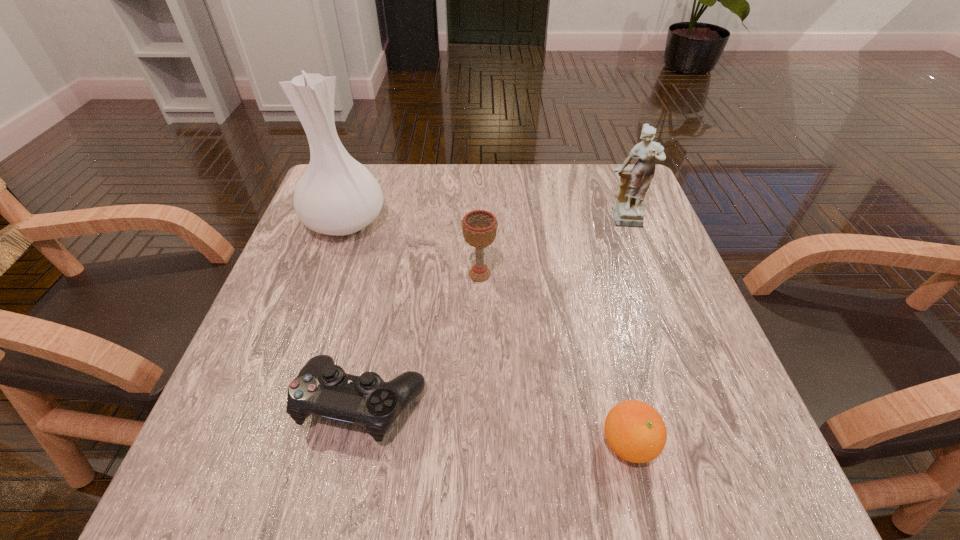
You are a GUI agent. You are given a task and a screenshot of the screen. Output one action in this format:
    pyautogui.click(x=<x>, y=<y>)
    Task: Click on the empty location between the vase and the orange
    This screenshot has width=960, height=540.
    Given the screenshot: What is the action you would take?
    pyautogui.click(x=487, y=333)

You are a GUI agent. You are given a task and a screenshot of the screen. Output one action in this format:
    pyautogui.click(x=<x>, y=<y>)
    Task: Click on the vacant space that is in between the third tallest object and the tallest object
    
    Given the screenshot: What is the action you would take?
    pyautogui.click(x=413, y=248)

Locate an element on the screen. The width and height of the screenshot is (960, 540). vacant space that is in between the rightmost object and the fourth object from left to right is located at coordinates (626, 333).

Find the location of a particular element. The width and height of the screenshot is (960, 540). vacant area between the tallest object and the third shortest object is located at coordinates click(413, 248).

Locate an element on the screen. The width and height of the screenshot is (960, 540). vacant area that lies between the third object from left to right and the control is located at coordinates (421, 339).

Find the location of `vacant point located between the second object from right to left and the vase`. vacant point located between the second object from right to left and the vase is located at coordinates (487, 333).

This screenshot has height=540, width=960. I want to click on free space between the control and the orange, so click(496, 423).

This screenshot has height=540, width=960. Identify the location of free spot between the figurine and the orange. (626, 333).

Choose which object is the nearest neighbor to the vase. Please provide its 2D coordinates. Your answer should be formatted as a tuple, i.e. [(x, y)], where the tuple contains the x and y coordinates of a point satisfying the conditions above.

[(479, 227)]

Select which object is the fourth closest to the third farthest object. Please provide its 2D coordinates. Your answer should be formatted as a tuple, i.e. [(x, y)], where the tuple contains the x and y coordinates of a point satisfying the conditions above.

[(635, 431)]